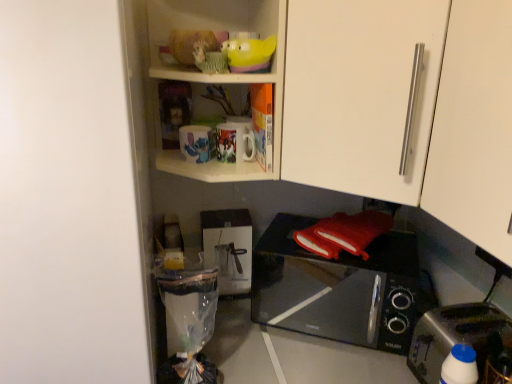
Measure the distance between white matte cabinet door at upper right, which is the 2th cabinetry in front-to-back order, and camera.

They are 28.33 inches apart.

The image size is (512, 384). What do you see at coordinates (218, 74) in the screenshot?
I see `matte ceramic mugs at upper center` at bounding box center [218, 74].

You are a GUI agent. You are given a task and a screenshot of the screen. Output one action in this format:
    pyautogui.click(x=<x>, y=<y>)
    Task: Click on the black glossy microwave oven at lower center
    
    Given the screenshot: What is the action you would take?
    pyautogui.click(x=340, y=288)

I want to click on translucent yellow bowl at upper center, so click(249, 54).

Image resolution: width=512 pixels, height=384 pixels. Find the location of `white matte cabinet door at upper right, which is the 2th cabinetry in front-to-back order`. white matte cabinet door at upper right, which is the 2th cabinetry in front-to-back order is located at coordinates (360, 94).

Looking at this image, is white matte door at left positioned far away from white matte cabinet door at upper right, which is the 1th cabinetry from back to front?

No.

What's the angular difference between white matte door at left and white matte cabinet door at upper right, which is the 1th cabinetry from back to front,'s facing directions?

The angular difference between white matte door at left and white matte cabinet door at upper right, which is the 1th cabinetry from back to front, is 42.6 degrees.

Can you confirm if white matte door at left is wider than white matte cabinet door at upper right, which is the 1th cabinetry from back to front?

Yes.

Between white matte door at left and white matte cabinet door at upper right, which is the 2th cabinetry in front-to-back order, which one has more height?

white matte door at left is taller.

From a real-world perspective, is white plastic bottle at lower right above or below translucent yellow bowl at upper center?

In terms of real-world spatial position, white plastic bottle at lower right is below translucent yellow bowl at upper center.

Is white plastic bottle at lower right in front of translucent yellow bowl at upper center?

Yes, it is in front of translucent yellow bowl at upper center.

Consider the image. Is white plastic bottle at lower right touching translucent yellow bowl at upper center?

No, white plastic bottle at lower right is not making contact with translucent yellow bowl at upper center.

From the image's perspective, is white plastic bottle at lower right on top of translucent yellow bowl at upper center?

Actually, white plastic bottle at lower right appears below translucent yellow bowl at upper center in the image.

Measure the distance between black glossy microwave oven at lower center and white matte door at left.

black glossy microwave oven at lower center and white matte door at left are 28.97 inches apart.

Which of these two, black glossy microwave oven at lower center or white matte door at left, is wider?

With larger width is white matte door at left.

Is point (344, 262) positioned behind point (62, 77)?

Yes, point (344, 262) is behind point (62, 77).

Is black glossy microwave oven at lower center looking in the opposite direction of white matte door at left?

No, white matte door at left is not at the back of black glossy microwave oven at lower center.

Is white matte cabinet handle at upper right, placed as the 1th cabinetry when sorted from front to back, thinner than translucent yellow bowl at upper center?

No.

Is there a large distance between white matte cabinet handle at upper right, placed as the 1th cabinetry when sorted from front to back, and translucent yellow bowl at upper center?

Actually, white matte cabinet handle at upper right, placed as the 1th cabinetry when sorted from front to back, and translucent yellow bowl at upper center are a little close together.

Which is in front, point (462, 5) or point (243, 56)?

Positioned in front is point (462, 5).

Which of these two, white matte cabinet handle at upper right, the 2th cabinetry positioned from the back, or translucent yellow bowl at upper center, stands taller?

Standing taller between the two is white matte cabinet handle at upper right, the 2th cabinetry positioned from the back.

How different are the orientations of white matte door at left and matte ceramic mugs at upper center in degrees?

white matte door at left and matte ceramic mugs at upper center are facing 0.565 degrees away from each other.

In terms of size, does white matte door at left appear bigger or smaller than matte ceramic mugs at upper center?

Clearly, white matte door at left is larger in size than matte ceramic mugs at upper center.

Is white matte door at left far from matte ceramic mugs at upper center?

They are positioned close to each other.

From the image's perspective, does white matte door at left appear higher than matte ceramic mugs at upper center?

Incorrect, from the image's perspective, white matte door at left is lower than matte ceramic mugs at upper center.

Considering the points (232, 41) and (80, 56), which point is in front, point (232, 41) or point (80, 56)?

Point (80, 56)

Which of these two, translucent yellow bowl at upper center or white matte door at left, is bigger?

white matte door at left is bigger.

From the image's perspective, which object appears higher, translucent yellow bowl at upper center or white matte door at left?

translucent yellow bowl at upper center.

Does point (293, 221) come farther from viewer compared to point (354, 51)?

Yes, point (293, 221) is behind point (354, 51).

Is black glossy microwave oven at lower center located outside white matte cabinet door at upper right, which is the 2th cabinetry in front-to-back order?

black glossy microwave oven at lower center lies outside white matte cabinet door at upper right, which is the 2th cabinetry in front-to-back order,'s area.

Is black glossy microwave oven at lower center to the left or to the right of white matte cabinet door at upper right, which is the 1th cabinetry from back to front, in the image?

From the image, it's evident that black glossy microwave oven at lower center is to the left of white matte cabinet door at upper right, which is the 1th cabinetry from back to front.

I want to click on door located below the white matte cabinet door at upper right, which is the 1th cabinetry from back to front (from the image's perspective), so click(x=67, y=199).

This screenshot has width=512, height=384. I want to click on toy that appears on the left of white plastic bottle at lower right, so click(249, 54).

Looking at the image, which one is located further to black glossy microwave oven at lower center, white matte cabinet handle at upper right, placed as the 1th cabinetry when sorted from front to back, or white plastic bottle at lower right?

Among the two, white matte cabinet handle at upper right, placed as the 1th cabinetry when sorted from front to back, is located further to black glossy microwave oven at lower center.

When comparing their distances from white matte cabinet handle at upper right, placed as the 1th cabinetry when sorted from front to back, does translucent yellow bowl at upper center or white matte cabinet door at upper right, which is the 2th cabinetry in front-to-back order, seem further?

Among the two, translucent yellow bowl at upper center is located further to white matte cabinet handle at upper right, placed as the 1th cabinetry when sorted from front to back.

Which object lies nearer to the anchor point white matte cabinet handle at upper right, the 2th cabinetry positioned from the back, translucent yellow bowl at upper center or matte ceramic mugs at upper center?

Based on the image, translucent yellow bowl at upper center appears to be nearer to white matte cabinet handle at upper right, the 2th cabinetry positioned from the back.

Which object lies nearer to the anchor point matte ceramic mugs at upper center, white matte cabinet door at upper right, which is the 2th cabinetry in front-to-back order, or translucent yellow bowl at upper center?

Among the two, white matte cabinet door at upper right, which is the 2th cabinetry in front-to-back order, is located nearer to matte ceramic mugs at upper center.

In the scene shown: From the image, which object appears to be farther from black glossy microwave oven at lower center, translucent yellow bowl at upper center or white plastic bottle at lower right?

translucent yellow bowl at upper center lies further to black glossy microwave oven at lower center than the other object.

Considering their positions, is black glossy microwave oven at lower center positioned closer to white matte cabinet handle at upper right, placed as the 1th cabinetry when sorted from front to back, than white matte door at left?

white matte door at left is positioned closer to the anchor white matte cabinet handle at upper right, placed as the 1th cabinetry when sorted from front to back.

Based on their spatial positions, is black glossy microwave oven at lower center or matte ceramic mugs at upper center closer to white plastic bottle at lower right?

black glossy microwave oven at lower center lies closer to white plastic bottle at lower right than the other object.

When comparing their distances from white matte cabinet handle at upper right, placed as the 1th cabinetry when sorted from front to back, does matte ceramic mugs at upper center or white matte door at left seem further?

Among the two, white matte door at left is located further to white matte cabinet handle at upper right, placed as the 1th cabinetry when sorted from front to back.

Locate an element on the screen. toy between white matte door at left and white matte cabinet door at upper right, which is the 1th cabinetry from back to front is located at coordinates (249, 54).

The width and height of the screenshot is (512, 384). What are the coordinates of `cabinet between white matte door at left and white matte cabinet handle at upper right, placed as the 1th cabinetry when sorted from front to back, in the horizontal direction` in the screenshot? It's located at (218, 74).

Locate an element on the screen. cabinet that lies between translucent yellow bowl at upper center and white matte door at left from top to bottom is located at coordinates (218, 74).

Where is `cabinetry situated between matte ceramic mugs at upper center and white matte cabinet handle at upper right, placed as the 1th cabinetry when sorted from front to back, from left to right`? cabinetry situated between matte ceramic mugs at upper center and white matte cabinet handle at upper right, placed as the 1th cabinetry when sorted from front to back, from left to right is located at coordinates (360, 94).